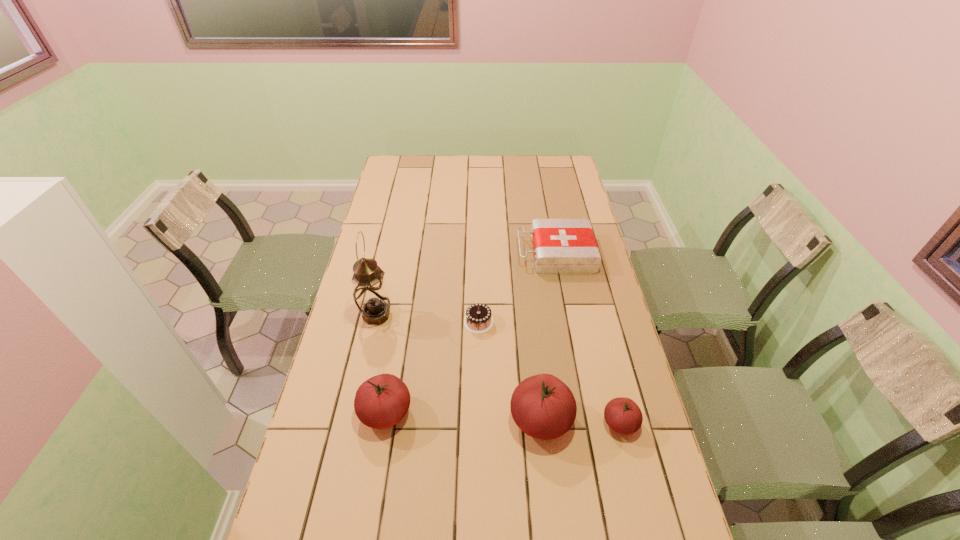
The image size is (960, 540). In order to click on the leftmost tomato in this screenshot , I will do `click(382, 401)`.

Image resolution: width=960 pixels, height=540 pixels. Identify the location of the third tallest object. (382, 401).

Image resolution: width=960 pixels, height=540 pixels. I want to click on the second tomato from right to left, so (x=543, y=407).

Identify the location of the rightmost tomato. The height and width of the screenshot is (540, 960). (623, 415).

Where is `the farthest object`? This screenshot has width=960, height=540. the farthest object is located at coordinates (561, 246).

Where is `chocolate cake`? The image size is (960, 540). chocolate cake is located at coordinates (478, 319).

Where is `the tallest object`? This screenshot has height=540, width=960. the tallest object is located at coordinates (370, 293).

Where is `free space located 0.080m on the right of the third tallest object`? The height and width of the screenshot is (540, 960). free space located 0.080m on the right of the third tallest object is located at coordinates (442, 412).

Identify the location of free space located 0.070m on the left of the second tomato from right to left. The height and width of the screenshot is (540, 960). (484, 420).

The height and width of the screenshot is (540, 960). I want to click on vacant space located on the front of the shortest tomato, so click(630, 463).